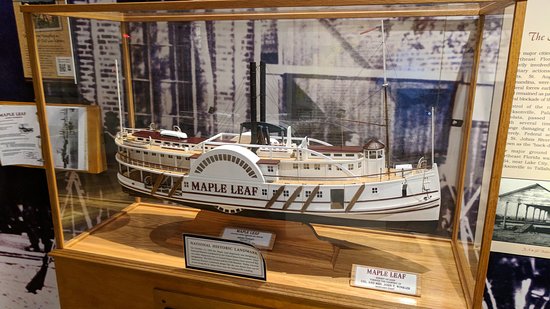
Identify the location of wooden frame. The width and height of the screenshot is (550, 309). (285, 288), (30, 44), (55, 5), (264, 13), (513, 34), (476, 41).